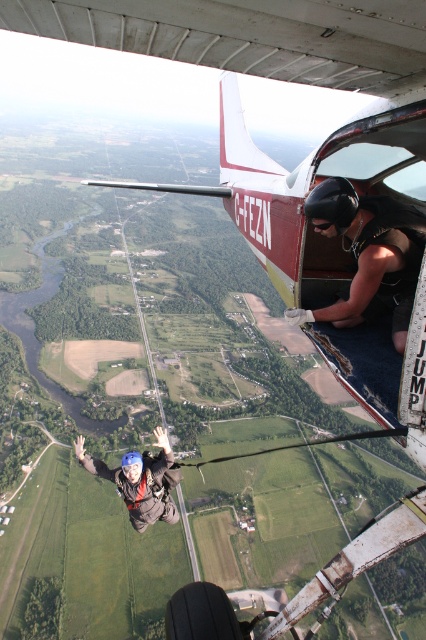
You are a photographer in the aircraft observing the skydivers. You want to capture a photo where both the black matte helmet at upper right and the blue helmeted skydiver at center are clearly visible. Which helmet will appear closer to the camera in the photo?

The blue helmeted skydiver at center will appear closer to the camera because objects that are larger in the image are typically closer to the observer. Since the black matte helmet at upper right is smaller than the blue helmeted skydiver at center, the latter is nearer.

You are a pilot observing the skydivers from the aircraft. You notice a black matte helmet at upper right and a blue helmeted skydiver at center. Which of these two objects is positioned to the right side of the other?

The black matte helmet at upper right is positioned to the right of the blue helmeted skydiver at center.

You are a pilot observing the skydivers from the aircraft. You notice the black matte helmet at upper right and the blue helmeted skydiver at center. Which skydiver is higher in the air?

The black matte helmet at upper right is located above the blue helmeted skydiver at center, so the skydiver with the black matte helmet at upper right is higher in the air.